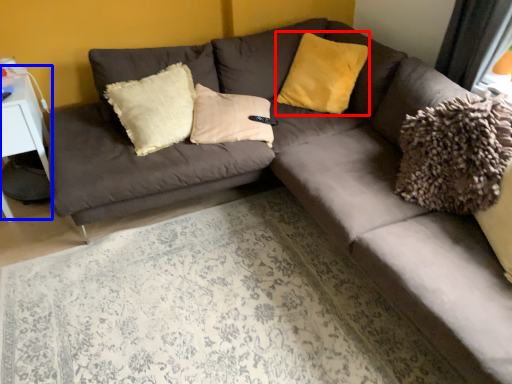
Question: Which point is further to the camera, pillow (highlighted by a red box) or table (highlighted by a blue box)?

Choices:
 (A) pillow
 (B) table

Answer: (A)